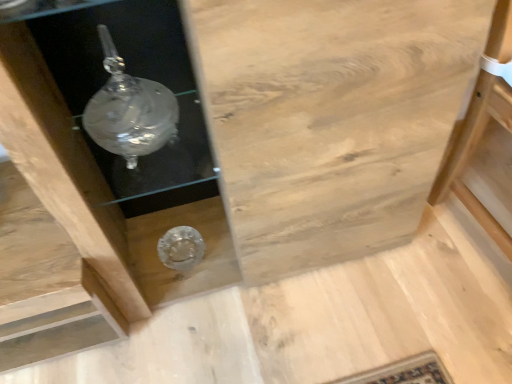
Question: In terms of size, does natural wood cabinet at center appear bigger or smaller than natural wood table at right?

Choices:
 (A) small
 (B) big

Answer: (B)

Question: Is natural wood cabinet at center wider or thinner than natural wood table at right?

Choices:
 (A) wide
 (B) thin

Answer: (B)

Question: Is natural wood cabinet at center taller or shorter than natural wood table at right?

Choices:
 (A) tall
 (B) short

Answer: (A)

Question: From a real-world perspective, relative to natural wood cabinet at center, is natural wood table at right vertically above or below?

Choices:
 (A) below
 (B) above

Answer: (A)

Question: Would you say natural wood table at right is inside or outside natural wood cabinet at center?

Choices:
 (A) inside
 (B) outside

Answer: (B)

Question: Considering the relative positions of natural wood table at right and natural wood cabinet at center in the image provided, is natural wood table at right to the left or to the right of natural wood cabinet at center?

Choices:
 (A) right
 (B) left

Answer: (A)

Question: Is natural wood table at right taller or shorter than natural wood cabinet at center?

Choices:
 (A) tall
 (B) short

Answer: (B)